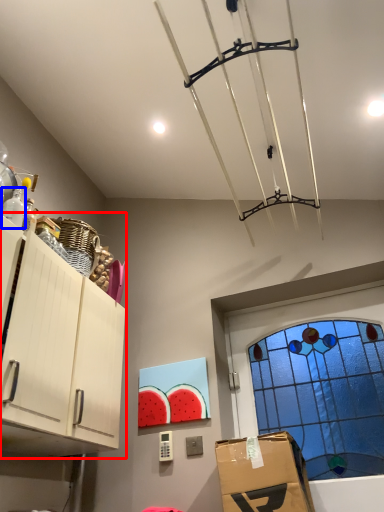
Question: Which object appears farthest to the camera in this image, cabinetry (highlighted by a red box) or bottle (highlighted by a blue box)?

Choices:
 (A) cabinetry
 (B) bottle

Answer: (B)